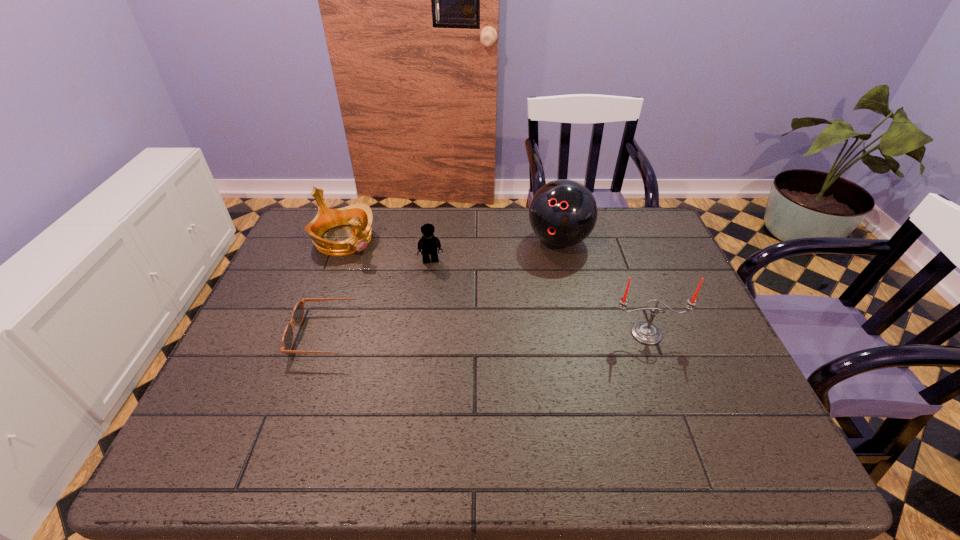
Where is `free spot on the desktop that is between the shortest object and the candle and is positioned on the surface of the bowling ball near the finger holes`? This screenshot has width=960, height=540. free spot on the desktop that is between the shortest object and the candle and is positioned on the surface of the bowling ball near the finger holes is located at coordinates (503, 334).

Locate an element on the screen. vacant space on the desktop that is between the sunglasses and the candle and is positioned on the front-facing side of the third object from right to left is located at coordinates (444, 334).

I want to click on free space on the desktop that is between the sunglasses and the candle and is positioned at the front emblem of the tiara, so click(x=466, y=334).